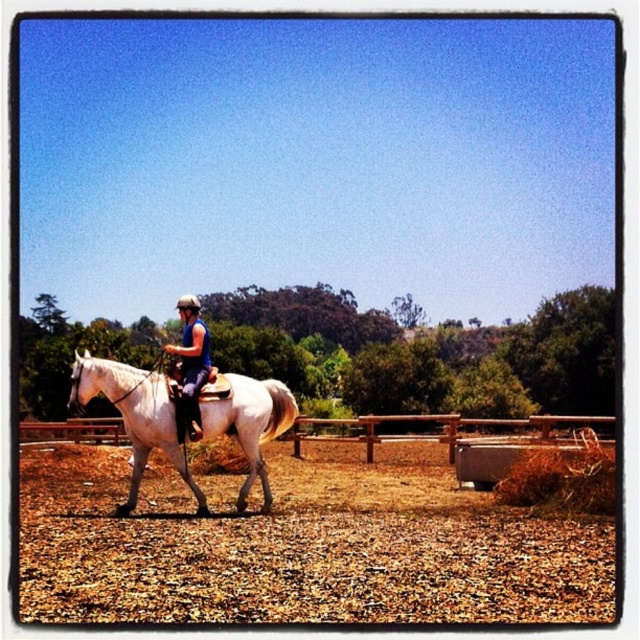
Question: Which object is closer to the camera taking this photo?

Choices:
 (A) white glossy horse at center
 (B) blue fabric helmet at center

Answer: (A)

Question: Which of the following is the farthest from the observer?

Choices:
 (A) (460, 577)
 (B) (324, 429)
 (C) (150, 397)
 (D) (202, 364)

Answer: (B)

Question: Does brown wooden fence at center lie in front of white glossy horse at center?

Choices:
 (A) yes
 (B) no

Answer: (B)

Question: Which of the following is the closest to the observer?

Choices:
 (A) blue fabric helmet at center
 (B) white glossy horse at center

Answer: (B)

Question: Is brown wooden fence at center positioned before white glossy horse at center?

Choices:
 (A) no
 (B) yes

Answer: (A)

Question: From the image, what is the correct spatial relationship of brown wooden fence at center in relation to blue fabric helmet at center?

Choices:
 (A) above
 (B) below

Answer: (B)